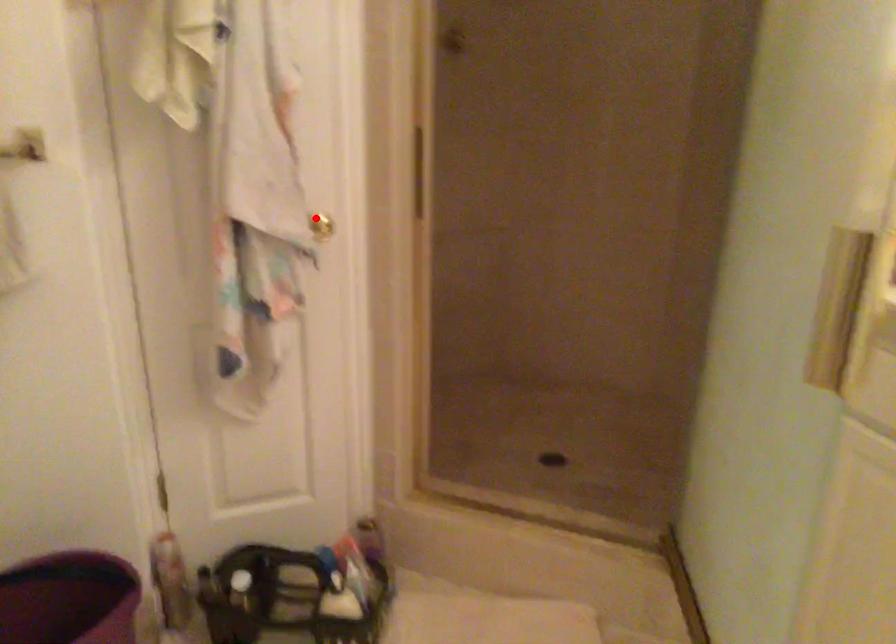
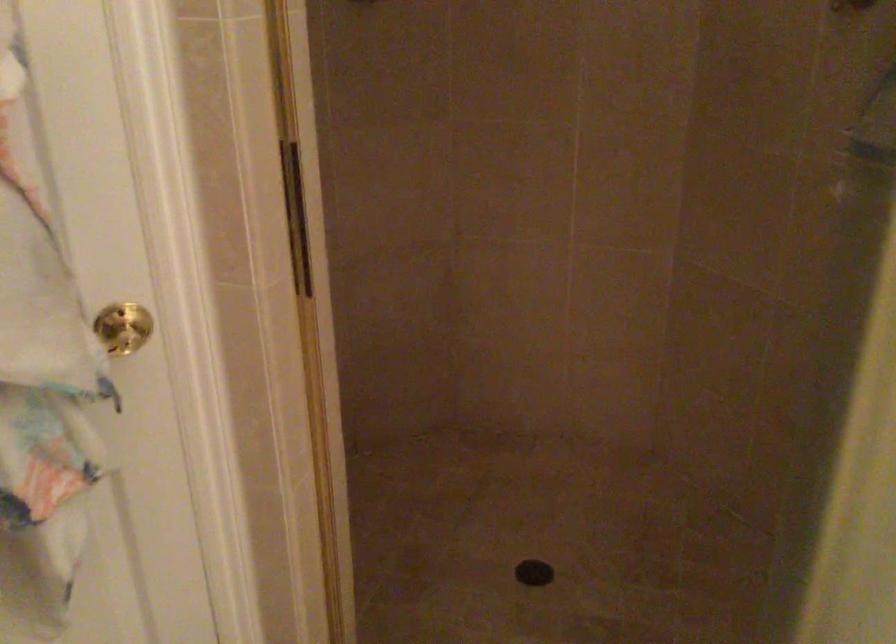
Question: I am providing you with two images of the same scene from different viewpoints. In image1, a red point is highlighted. Considering the same 3D point in image2, which of the following is correct?

Choices:
 (A) It is closer
 (B) It is farther

Answer: (A)